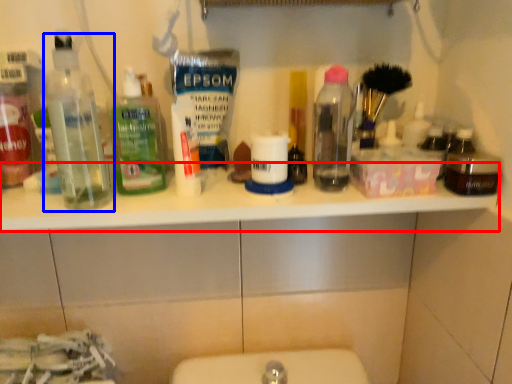
Question: Among these objects, which one is farthest to the camera, counter top (highlighted by a red box) or bottle (highlighted by a blue box)?

Choices:
 (A) counter top
 (B) bottle

Answer: (A)